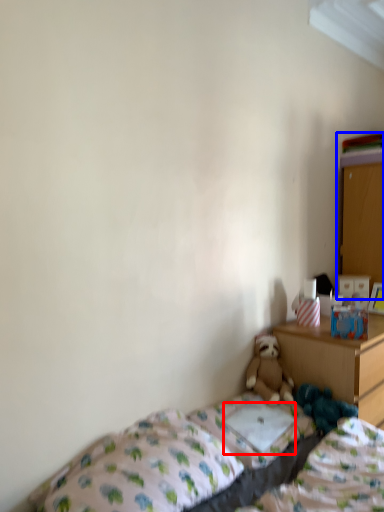
Question: Which object is closer to the camera taking this photo, pillow (highlighted by a red box) or dresser (highlighted by a blue box)?

Choices:
 (A) pillow
 (B) dresser

Answer: (A)